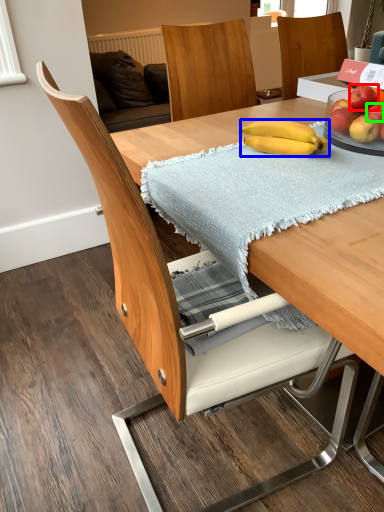
Question: Estimate the real-world distances between objects in this image. Which object is farther from apple (highlighted by a red box), banana (highlighted by a blue box) or apple (highlighted by a green box)?

Choices:
 (A) banana
 (B) apple

Answer: (A)